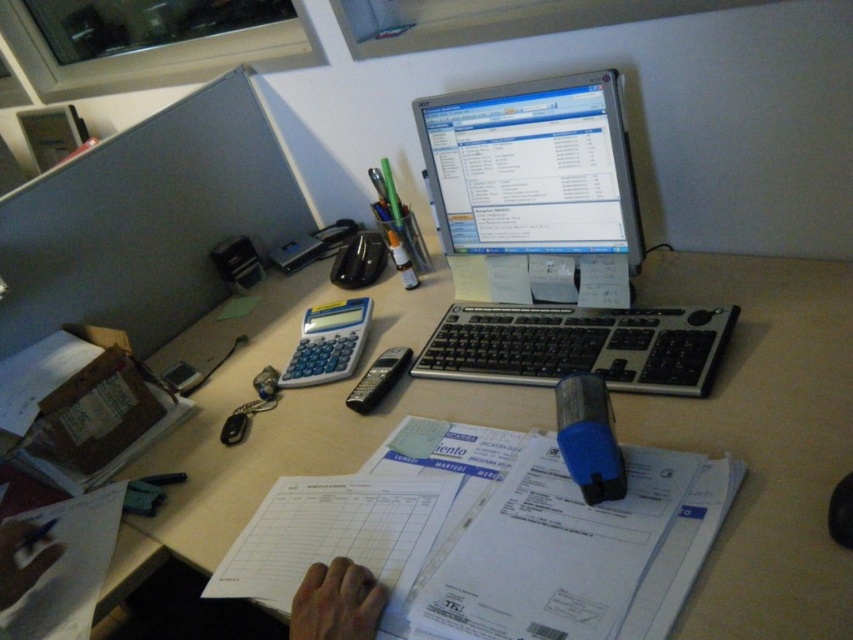
You are a delivery person who needs to place a small package on the desk without touching any objects. The desk has a skinny flesh at lower center and a blue plastic calculator at center. Can you fit the package between them if it requires 20 inches of space?

The skinny flesh at lower center and blue plastic calculator at center are 20.18 inches apart, so yes, the package requiring 20 inches of space can fit between them since there is enough space.

You are organizing your desk and notice the white plastic computer desk at center and the black plastic keyboard at center. Which object is positioned lower in relation to the other?

The white plastic computer desk at center is below the black plastic keyboard at center, so the desk is positioned lower than the keyboard.